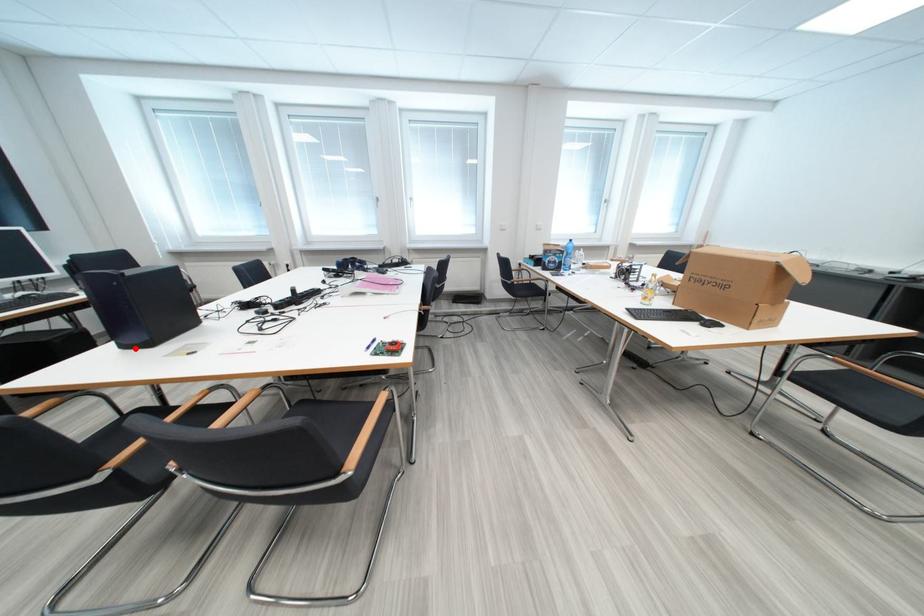
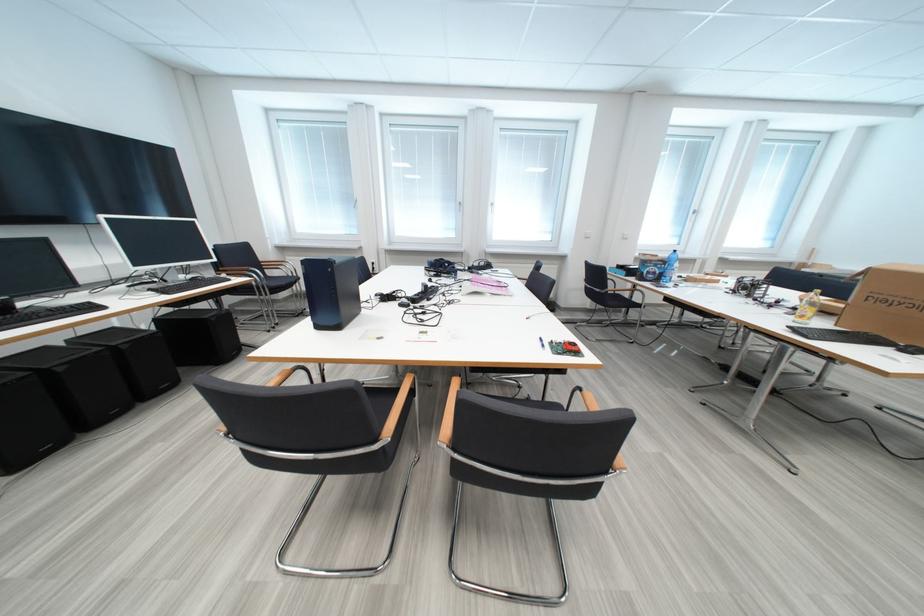
Find the pixel in the second image that matches the highlighted location in the first image.

(329, 330)